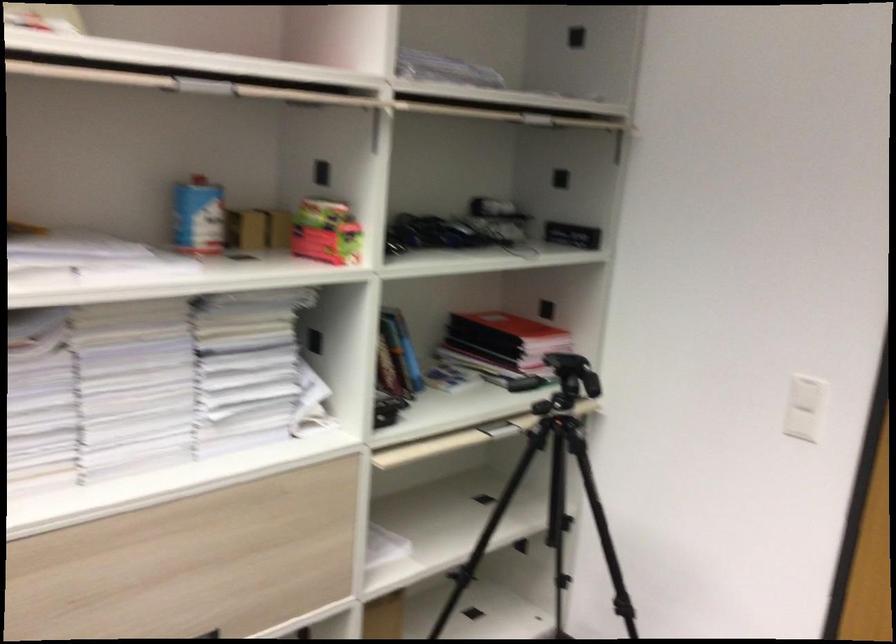
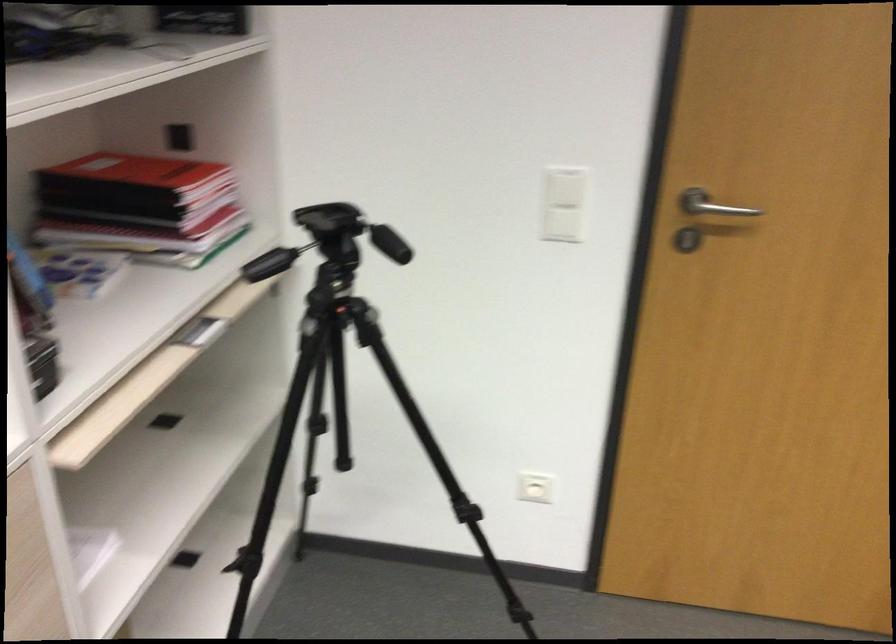
Where in the second image is the point corresponding to point 807,424 from the first image?

(563, 225)